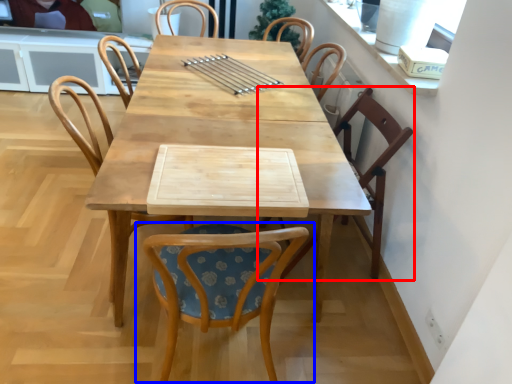
Question: Which of the following is the farthest to the observer, chair (highlighted by a red box) or chair (highlighted by a blue box)?

Choices:
 (A) chair
 (B) chair

Answer: (A)